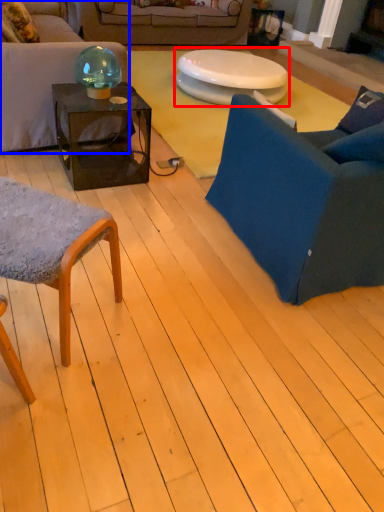
Question: Which point is closer to the camera, table (highlighted by a red box) or studio couch (highlighted by a blue box)?

Choices:
 (A) table
 (B) studio couch

Answer: (B)